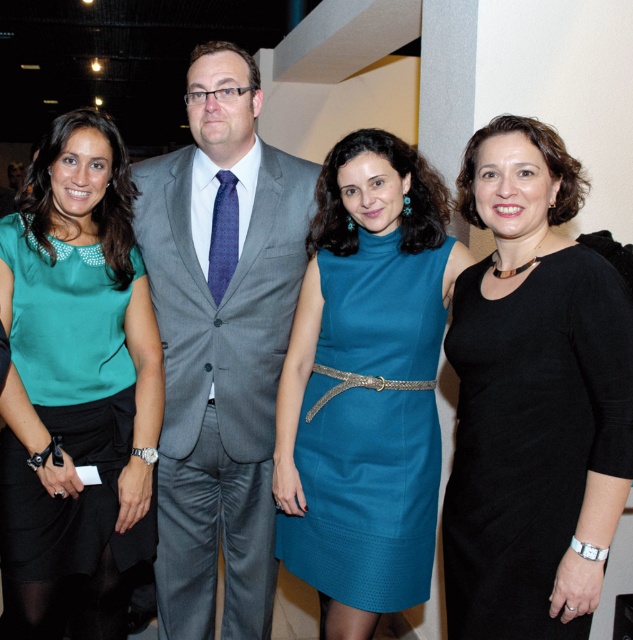
Question: Can you confirm if gray wool suit at center is positioned above teal fabric dress at center?

Choices:
 (A) no
 (B) yes

Answer: (B)

Question: Which object is farther from the camera taking this photo?

Choices:
 (A) black knit dress at right
 (B) gray wool suit at center

Answer: (B)

Question: Among these objects, which one is farthest from the camera?

Choices:
 (A) gray wool suit at center
 (B) black knit dress at right
 (C) teal fabric dress at center

Answer: (A)

Question: Which point appears farthest from the camera in this image?

Choices:
 (A) (406, 531)
 (B) (454, 349)

Answer: (A)

Question: Does gray wool suit at center have a larger size compared to black knit dress at right?

Choices:
 (A) no
 (B) yes

Answer: (B)

Question: Is teal fabric blouse at left to the right of black knit dress at right from the viewer's perspective?

Choices:
 (A) no
 (B) yes

Answer: (A)